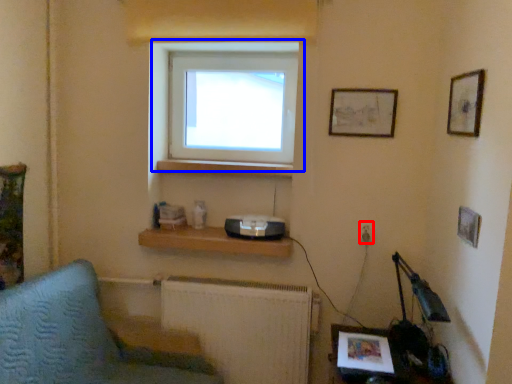
Question: Which of the following is the farthest to the observer, electric outlet (highlighted by a red box) or window (highlighted by a blue box)?

Choices:
 (A) electric outlet
 (B) window

Answer: (B)